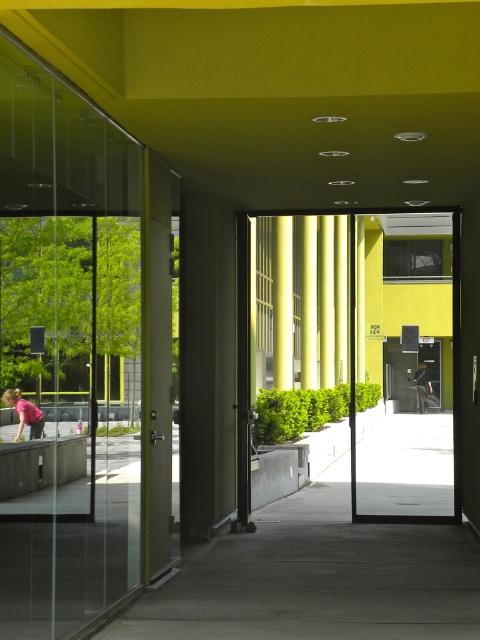
Locate an element on the screen. Image resolution: width=480 pixels, height=640 pixels. matte yellow door at center is located at coordinates [354, 356].

Does pink fabric at lower left have a lesser width compared to black leather jacket at center?

In fact, pink fabric at lower left might be wider than black leather jacket at center.

Between point (15, 397) and point (427, 378), which one is positioned behind?

The point (427, 378) is more distant.

Locate an element on the screen. Image resolution: width=480 pixels, height=640 pixels. pink fabric at lower left is located at coordinates (24, 413).

This screenshot has width=480, height=640. What do you see at coordinates (409, 368) in the screenshot?
I see `yellow matte door at center` at bounding box center [409, 368].

Between point (444, 449) and point (428, 404), which one is positioned in front?

Point (444, 449) is in front.

Between point (360, 307) and point (422, 392), which one is positioned in front?

Point (360, 307)

This screenshot has height=640, width=480. In order to click on yellow matte door at center in this screenshot , I will do `click(409, 368)`.